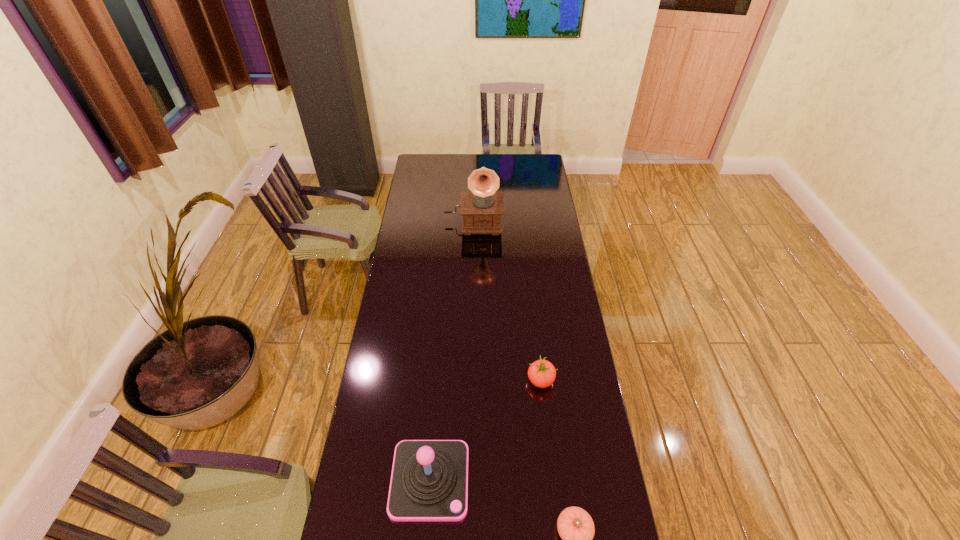
This screenshot has width=960, height=540. What are the coordinates of `record player` in the screenshot? It's located at (482, 209).

This screenshot has width=960, height=540. I want to click on the tallest object, so click(x=482, y=209).

Identify the location of the third shortest object. (429, 481).

Locate an element on the screen. The width and height of the screenshot is (960, 540). the third tallest object is located at coordinates (541, 373).

I want to click on the taller tomato, so click(541, 373).

What are the coordinates of `vacant space situated on the horn of the tallest object` in the screenshot? It's located at (472, 273).

Identify the location of vacant space located 0.280m on the front of the third tallest object. The image size is (960, 540). (551, 474).

Locate an element on the screen. object present at the left edge is located at coordinates (429, 481).

You are a GUI agent. You are given a task and a screenshot of the screen. Output one action in this format:
    pyautogui.click(x=<x>, y=<y>)
    Task: Click on the object located in the right edge section of the desktop
    The width and height of the screenshot is (960, 540).
    Given the screenshot: What is the action you would take?
    pyautogui.click(x=541, y=373)

In the image, there is a desktop. Where is `free space at the left edge`? free space at the left edge is located at coordinates (409, 257).